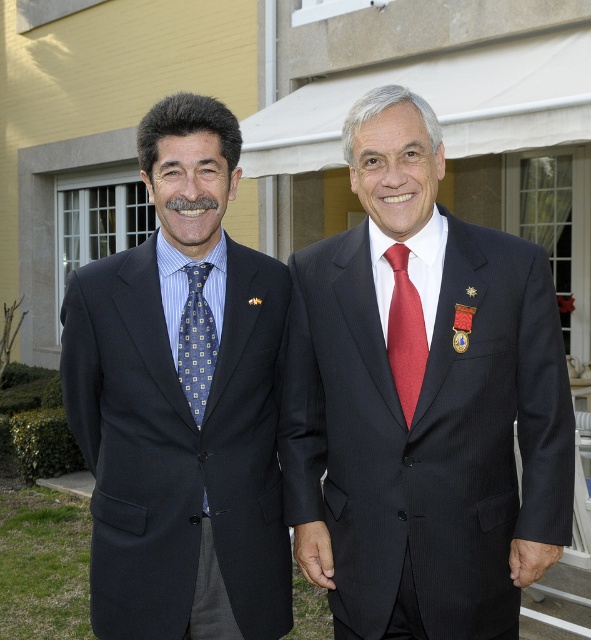
You are a photographer taking a picture of the two men. You notice their ties. Which tie, the shiny red tie at center or the blue patterned tie at left, appears taller in the photo?

The shiny red tie at center appears taller than the blue patterned tie at left in the photo because it has a greater height compared to the blue patterned tie at left.